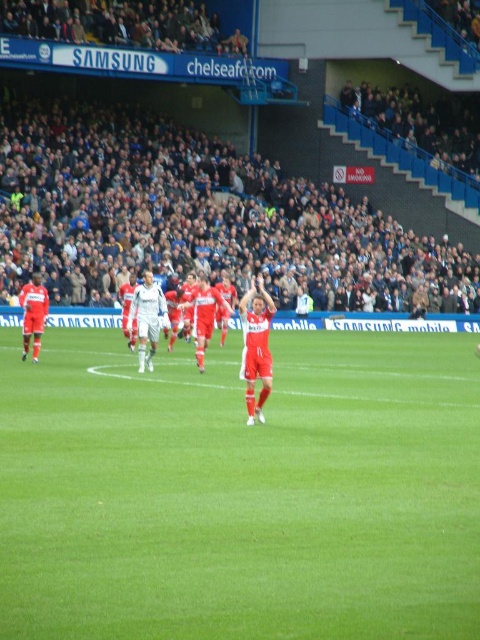
Can you confirm if green grass at center is wider than dark gray concrete stadium seating at upper center?

In fact, green grass at center might be narrower than dark gray concrete stadium seating at upper center.

Does green grass at center have a lesser height compared to dark gray concrete stadium seating at upper center?

Yes.

This screenshot has height=640, width=480. What are the coordinates of `green grass at center` in the screenshot? It's located at (240, 492).

Between dark gray concrete stadium seating at upper center and white matte soccer player at center, which one is positioned lower?

Positioned lower is white matte soccer player at center.

I want to click on dark gray concrete stadium seating at upper center, so click(199, 218).

Can you confirm if green grass at center is bigger than white matte soccer player at center?

Yes.

Can you confirm if green grass at center is shorter than white matte soccer player at center?

Incorrect, green grass at center's height does not fall short of white matte soccer player at center's.

The width and height of the screenshot is (480, 640). Find the location of `green grass at center`. green grass at center is located at coordinates (240, 492).

This screenshot has width=480, height=640. Identify the location of green grass at center. (240, 492).